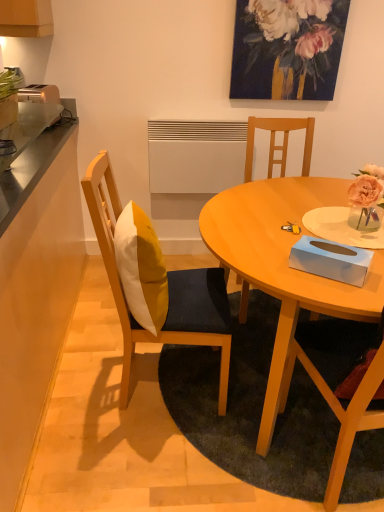
Question: Considering their positions, is metallic stainless steel counter top at left, the second counter top positioned from the left, located in front of or behind painted floral arrangement at upper center?

Choices:
 (A) behind
 (B) front

Answer: (B)

Question: Is metallic stainless steel counter top at left, which appears as the 1th counter top when viewed from the right, to the left or to the right of painted floral arrangement at upper center in the image?

Choices:
 (A) left
 (B) right

Answer: (A)

Question: Which object is positioned farthest from the wooden chair with cushion at left, acting as the 1th chair starting from the left?

Choices:
 (A) dark gray carpet at lower center
 (B) metallic silver toaster at left
 (C) yellow fabric pillow at center
 (D) painted floral arrangement at upper center
 (E) wooden chair at center, positioned as the second chair in left-to-right order

Answer: (D)

Question: Which is farther from the painted floral arrangement at upper center?

Choices:
 (A) metallic silver toaster at left
 (B) dark gray carpet at lower center
 (C) metallic stainless steel counter top at left, which appears as the 1th counter top when viewed from the right
 (D) matte wood table at center
 (E) metallic stainless steel counter at left, the 1th counter top when ordered from left to right

Answer: (B)